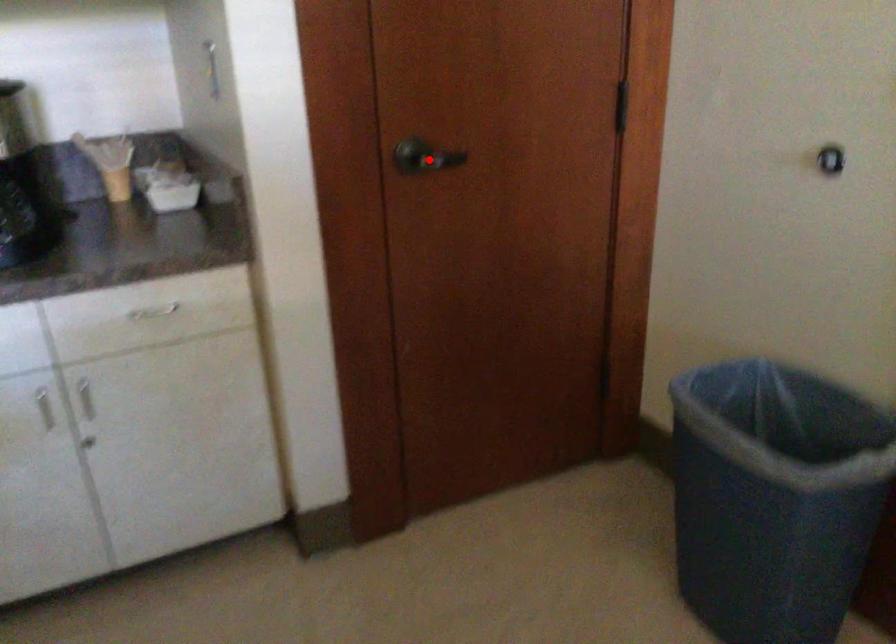
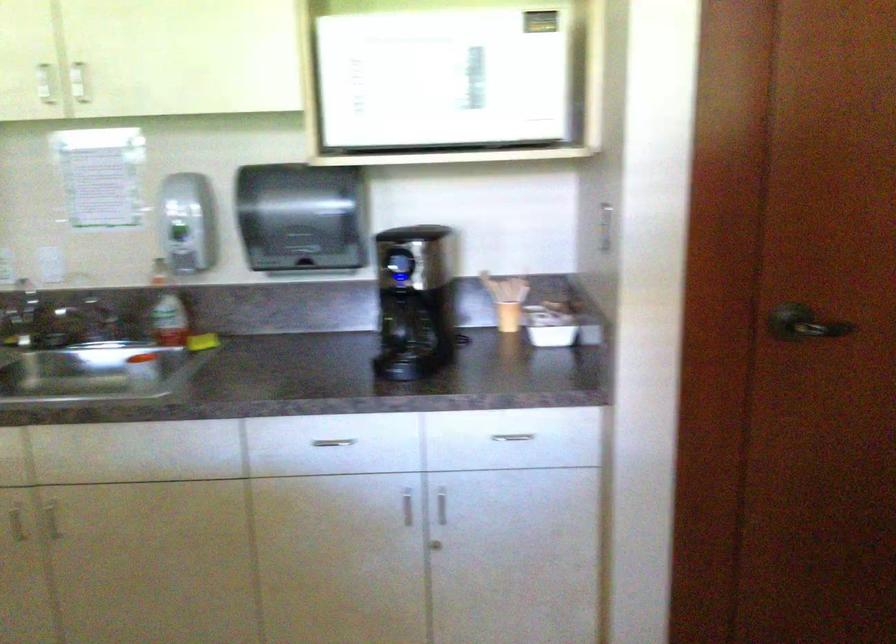
In the second image, find the point that corresponds to the highlighted location in the first image.

(803, 323)